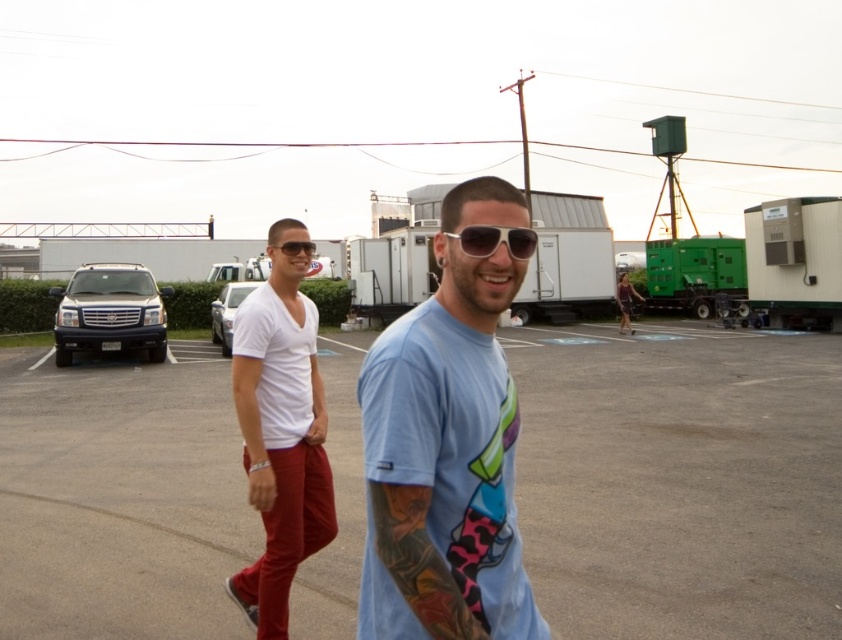
Question: Which point appears farthest from the camera in this image?

Choices:
 (A) (259, 460)
 (B) (201, 483)

Answer: (B)

Question: Does gray asphalt parking lot at center have a greater width compared to matte black sunglasses at center?

Choices:
 (A) no
 (B) yes

Answer: (B)

Question: Which object is the closest to the white matte shirt at center?

Choices:
 (A) sunglasses at center
 (B) matte black sunglasses at center
 (C) shiny black suv at left

Answer: (B)

Question: Is light blue t-shirt at center smaller than sunglasses at center?

Choices:
 (A) yes
 (B) no

Answer: (B)

Question: Which object is closer to the camera taking this photo?

Choices:
 (A) gray asphalt parking lot at center
 (B) sunglasses at center

Answer: (B)

Question: Is light blue t-shirt at center positioned before white matte shirt at center?

Choices:
 (A) yes
 (B) no

Answer: (A)